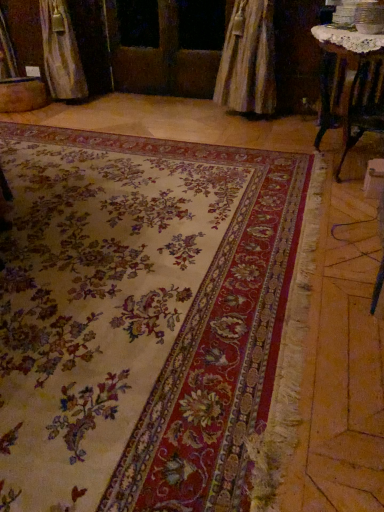
Question: Is wooden screen door at center smaller than wooden table at upper right?

Choices:
 (A) no
 (B) yes

Answer: (B)

Question: From a real-world perspective, is wooden screen door at center beneath wooden table at upper right?

Choices:
 (A) no
 (B) yes

Answer: (A)

Question: Is wooden screen door at center in contact with wooden table at upper right?

Choices:
 (A) no
 (B) yes

Answer: (A)

Question: Is wooden screen door at center to the right of wooden table at upper right from the viewer's perspective?

Choices:
 (A) no
 (B) yes

Answer: (A)

Question: Can you confirm if wooden screen door at center is shorter than wooden table at upper right?

Choices:
 (A) no
 (B) yes

Answer: (A)

Question: From their relative heights in the image, would you say wooden table at upper right is taller or shorter than wooden screen door at center?

Choices:
 (A) short
 (B) tall

Answer: (A)

Question: Is wooden table at upper right inside or outside of wooden screen door at center?

Choices:
 (A) inside
 (B) outside

Answer: (B)

Question: Is point (372, 36) closer or farther from the camera than point (213, 79)?

Choices:
 (A) farther
 (B) closer

Answer: (B)

Question: From the image's perspective, relative to wooden screen door at center, is wooden table at upper right above or below?

Choices:
 (A) above
 (B) below

Answer: (B)

Question: Does point (43, 403) appear closer or farther from the camera than point (345, 29)?

Choices:
 (A) farther
 (B) closer

Answer: (B)

Question: Is floral carpet at center inside or outside of wooden table at upper right?

Choices:
 (A) outside
 (B) inside

Answer: (A)

Question: In terms of width, does floral carpet at center look wider or thinner when compared to wooden table at upper right?

Choices:
 (A) thin
 (B) wide

Answer: (B)

Question: In terms of size, does floral carpet at center appear bigger or smaller than wooden table at upper right?

Choices:
 (A) big
 (B) small

Answer: (A)

Question: Relative to floral carpet at center, is wooden table at upper right in front or behind?

Choices:
 (A) behind
 (B) front

Answer: (A)

Question: From the image's perspective, is wooden table at upper right positioned above or below floral carpet at center?

Choices:
 (A) below
 (B) above

Answer: (B)